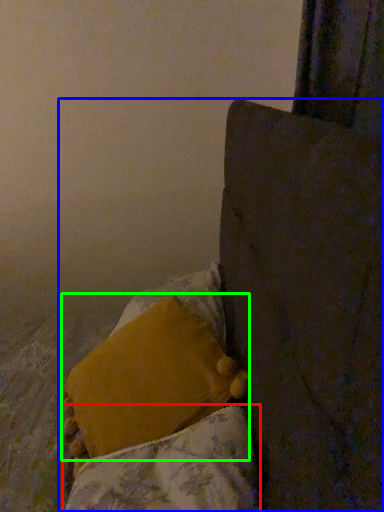
Question: Which is farther away from blanket (highlighted by a red box)? furniture (highlighted by a blue box) or pillow (highlighted by a green box)?

Choices:
 (A) furniture
 (B) pillow

Answer: (A)